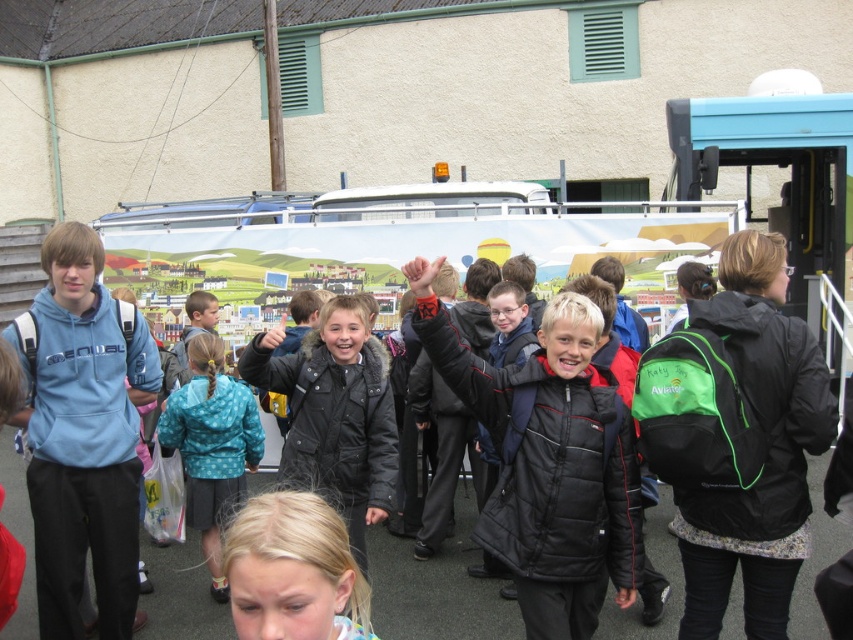
Who is positioned more to the left, black matte backpack at right or blonde hair at lower center?

blonde hair at lower center

Is black matte backpack at right closer to the viewer compared to blonde hair at lower center?

No.

Is point (724, 417) in front of point (268, 568)?

No, (724, 417) is further to viewer.

The height and width of the screenshot is (640, 853). I want to click on black matte backpack at right, so pos(737,436).

Can you confirm if black fuzzy jacket at center is wider than blue dotted jacket at center?

Yes, black fuzzy jacket at center is wider than blue dotted jacket at center.

Does point (273, 387) lie in front of point (213, 400)?

Yes.

Is point (354, 545) less distant than point (254, 461)?

Yes.

Identify the location of black fuzzy jacket at center. The height and width of the screenshot is (640, 853). (334, 413).

Who is positioned more to the left, blue fleece jacket at left or black fuzzy jacket at center?

Positioned to the left is blue fleece jacket at left.

Which of these two, blue fleece jacket at left or black fuzzy jacket at center, stands shorter?

With less height is black fuzzy jacket at center.

Locate an element on the screen. The width and height of the screenshot is (853, 640). blue fleece jacket at left is located at coordinates (83, 435).